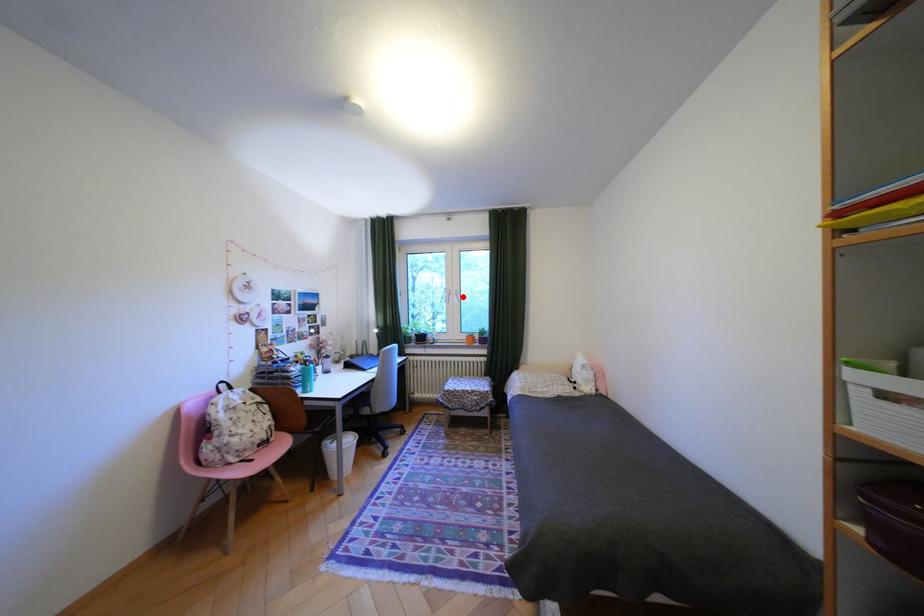
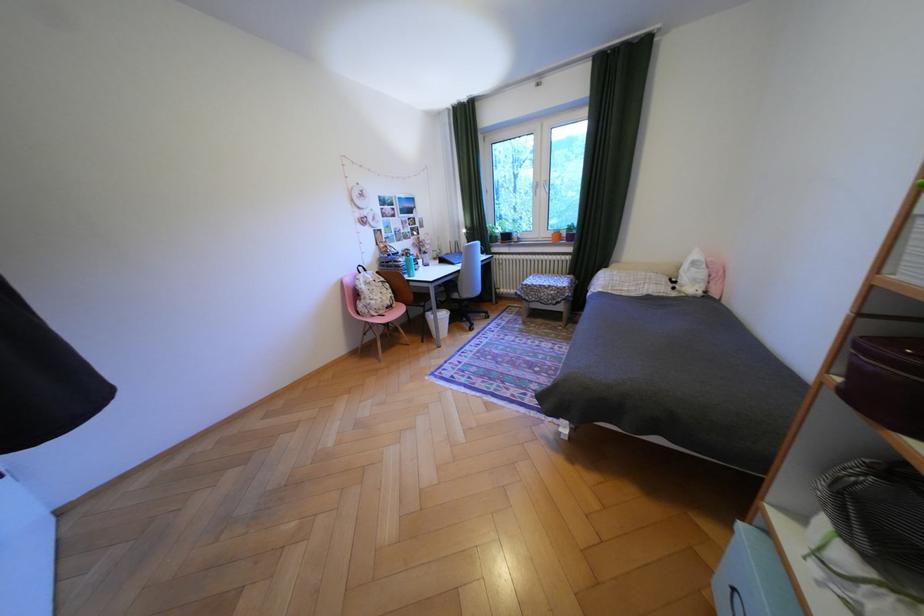
The point at the highlighted location is marked in the first image. Where is the corresponding point in the second image?

(551, 190)